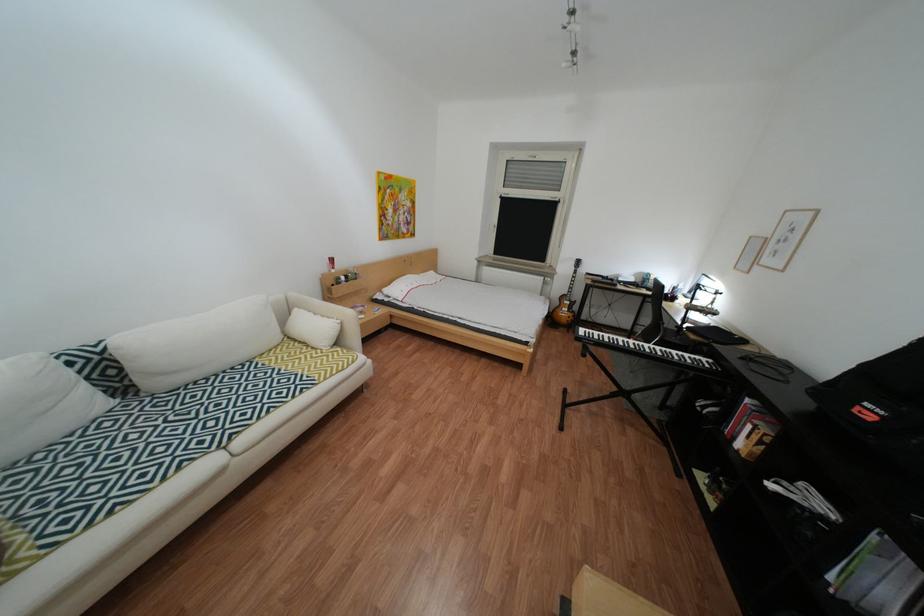
Find where to lift the large white pillow. Please return your answer as a coordinate pair (x, y).

(196, 344)